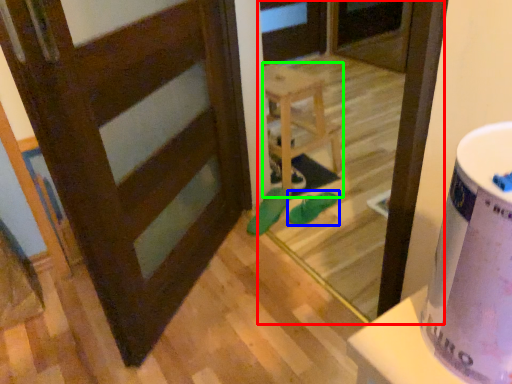
Question: Estimate the real-world distances between objects in this image. Which object is farther from screen door (highlighted by a red box), footwear (highlighted by a blue box) or furniture (highlighted by a green box)?

Choices:
 (A) footwear
 (B) furniture

Answer: (A)